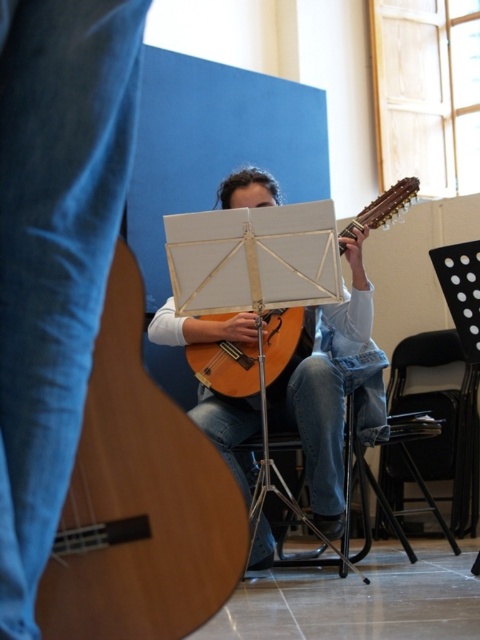
You are a musician who needs to choose between the black plastic chair at lower right and the black plastic chair at lower center for a performance. Which chair offers more legroom?

The black plastic chair at lower right has a greater width than the black plastic chair at lower center, so it provides more legroom.

You are a stagehand setting up a small performance area. You need to place a 10 inch wide decorative panel between the matte white music stand at center and the black plastic chair at lower center. Is there enough space for it?

The distance between the matte white music stand at center and the black plastic chair at lower center is 9.26 inches, which is less than the 10 inch width of the decorative panel. Therefore, there isn not enough space to place the panel between them.